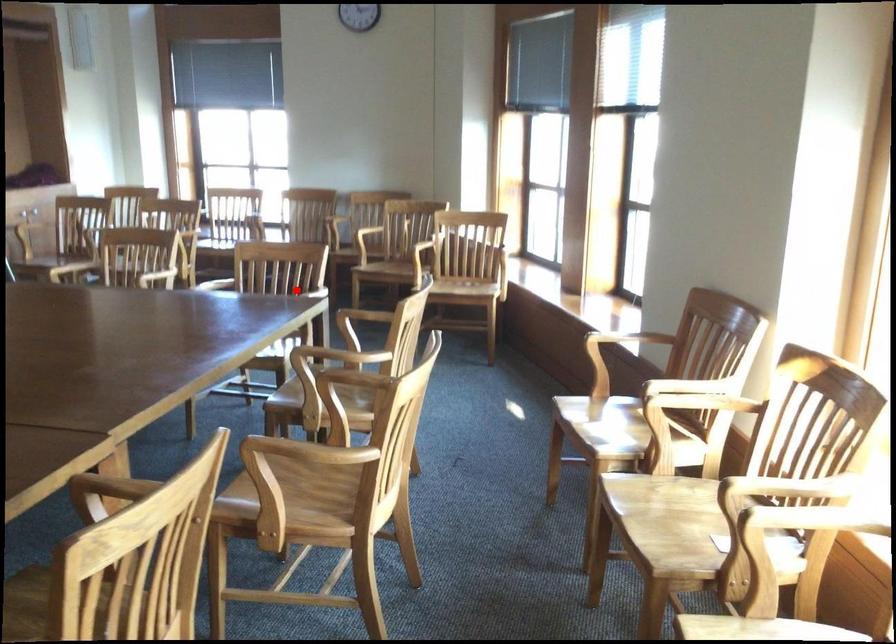
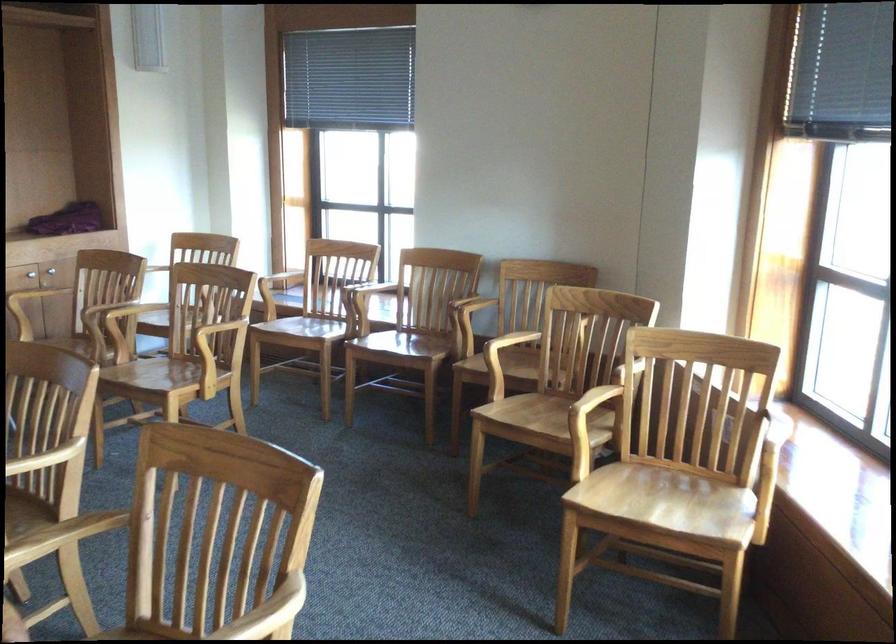
The point at the highlighted location is marked in the first image. Where is the corresponding point in the second image?

(268, 612)